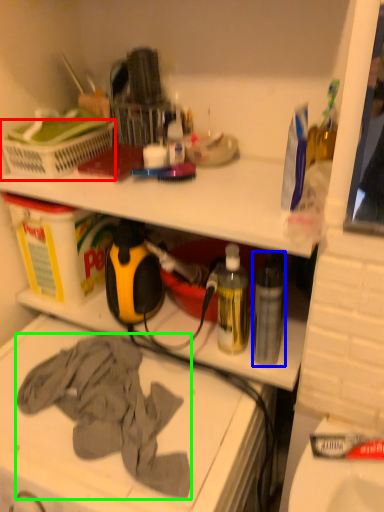
Question: Which is farther away from laundry basket (highlighted by a red box)? bottle (highlighted by a blue box) or clothing (highlighted by a green box)?

Choices:
 (A) bottle
 (B) clothing

Answer: (A)